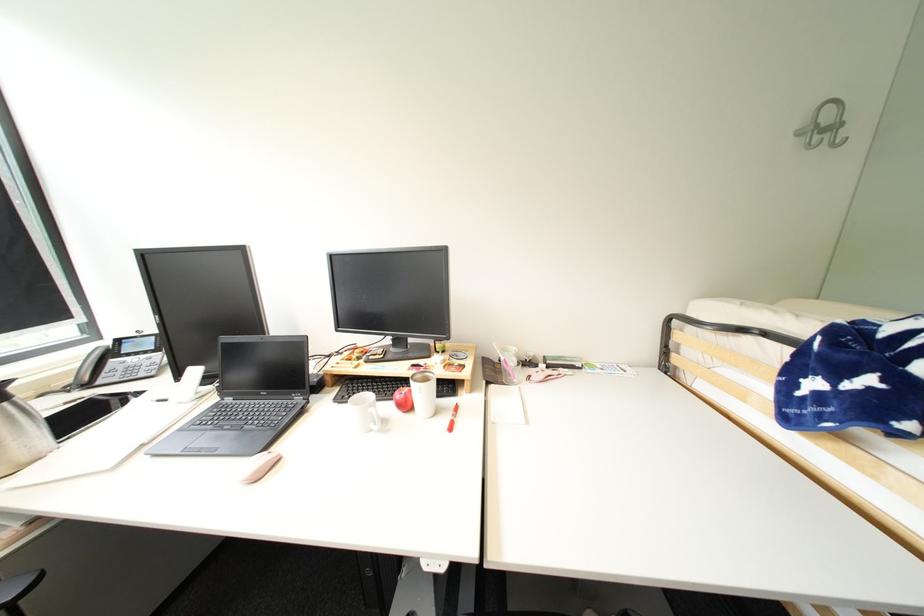
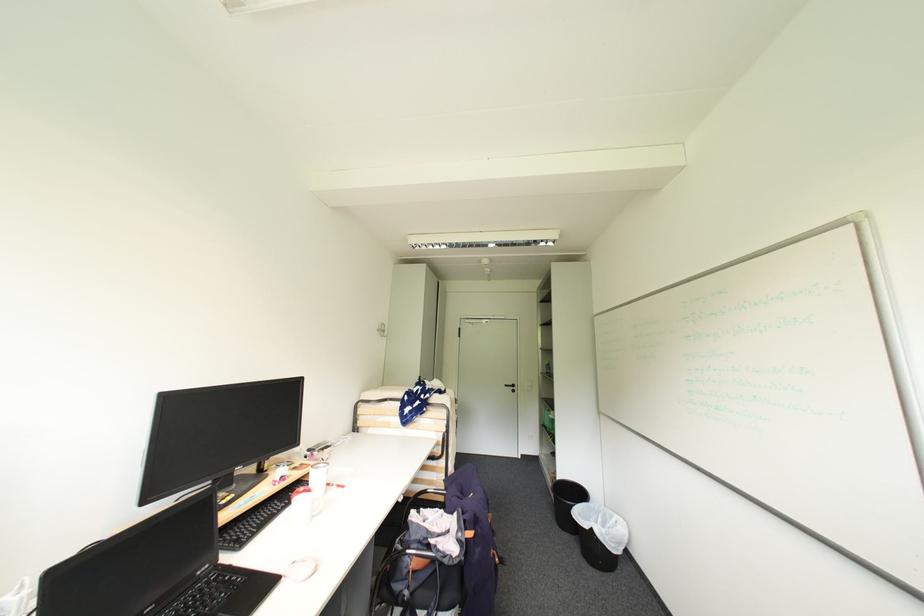
The point at (807, 132) is marked in the first image. Where is the corresponding point in the second image?

(384, 331)